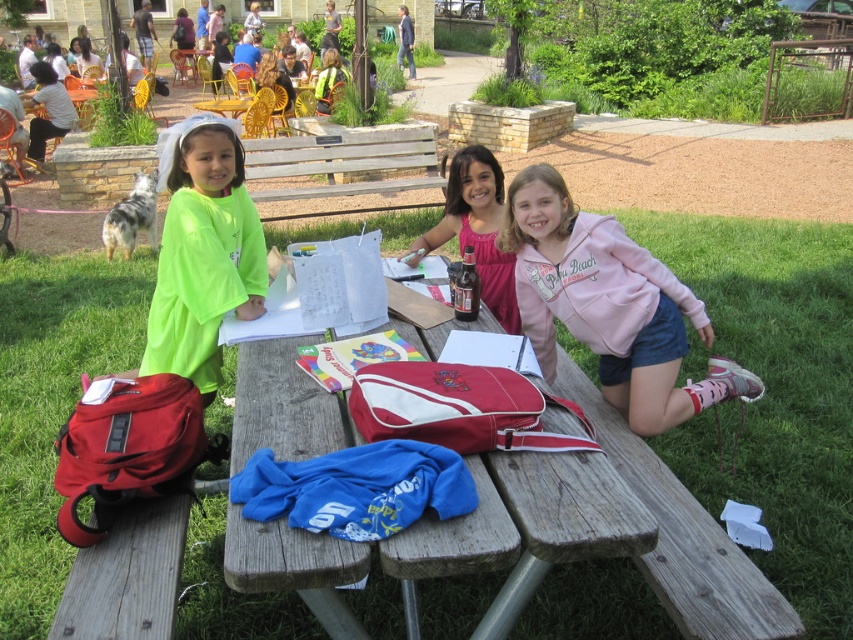
Which is behind, point (199, 161) or point (457, 218)?

Point (457, 218)

At what (x,y) coordinates should I click in order to perform the action: click on neon green t-shirt at left. Please return your answer as a coordinate pair (x, y). Image resolution: width=853 pixels, height=640 pixels. Looking at the image, I should click on (204, 259).

What do you see at coordinates (204, 259) in the screenshot?
I see `neon green t-shirt at left` at bounding box center [204, 259].

Where is `neon green t-shirt at left`? This screenshot has width=853, height=640. neon green t-shirt at left is located at coordinates pyautogui.click(x=204, y=259).

Between pink fleece hoodie at center and pink fabric shirt at center, which one is positioned lower?

Positioned lower is pink fleece hoodie at center.

Does pink fleece hoodie at center appear on the right side of pink fabric shirt at center?

Indeed, pink fleece hoodie at center is positioned on the right side of pink fabric shirt at center.

Who is more forward, (589, 264) or (512, 298)?

Point (589, 264) is more forward.

What are the coordinates of `pink fleece hoodie at center` in the screenshot? It's located at (608, 305).

Is pink fleece hoodie at center to the right of neon green t-shirt at left from the viewer's perspective?

Correct, you'll find pink fleece hoodie at center to the right of neon green t-shirt at left.

The height and width of the screenshot is (640, 853). Identify the location of pink fleece hoodie at center. (608, 305).